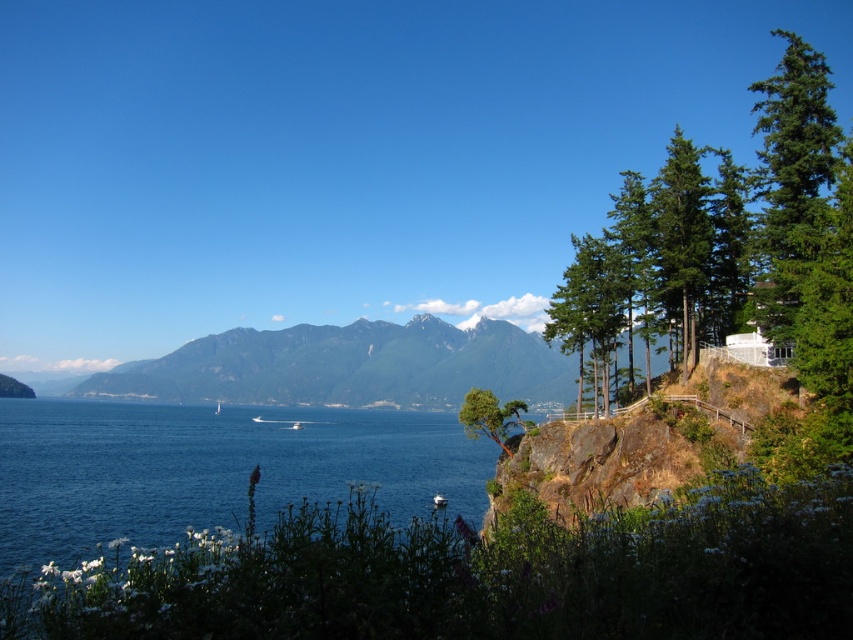
Question: Estimate the real-world distances between objects in this image. Which object is farther from the green textured tree at upper right?

Choices:
 (A) rocky gray mountain at center
 (B) blue water at lower left

Answer: (A)

Question: Which of the following is the closest to the observer?

Choices:
 (A) blue water at lower left
 (B) green rough bark tree at upper right
 (C) rocky gray mountain at center
 (D) green matte trees at right

Answer: (D)

Question: Where is blue water at lower left located in relation to green textured tree at upper right in the image?

Choices:
 (A) right
 (B) left

Answer: (B)

Question: Does blue water at lower left appear on the left side of green evergreen tree at upper right?

Choices:
 (A) yes
 (B) no

Answer: (A)

Question: Does green matte trees at right appear on the left side of green rough bark tree at upper right?

Choices:
 (A) no
 (B) yes

Answer: (A)

Question: Which point is farther from the camera taking this photo?

Choices:
 (A) (666, 220)
 (B) (236, 371)
 (C) (463, 419)

Answer: (B)